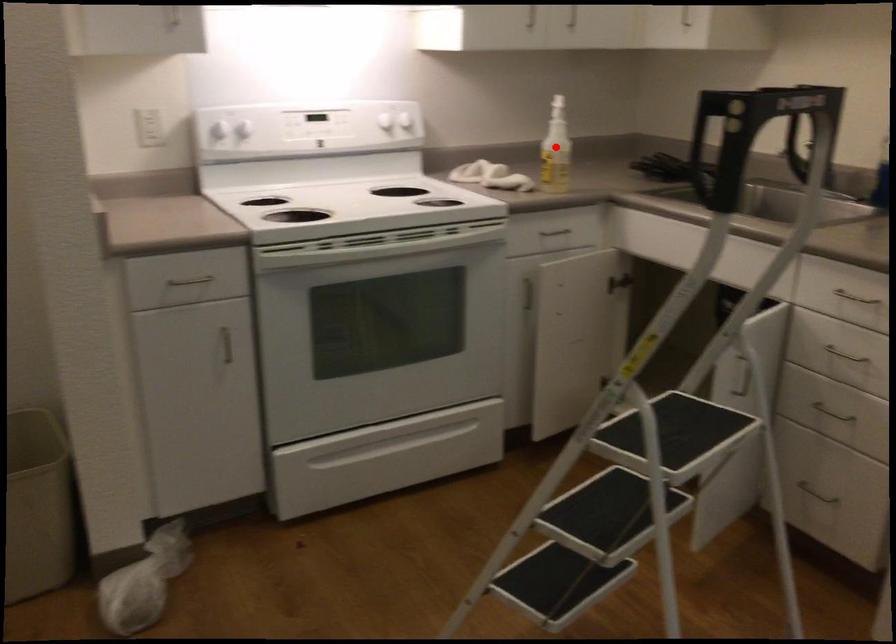
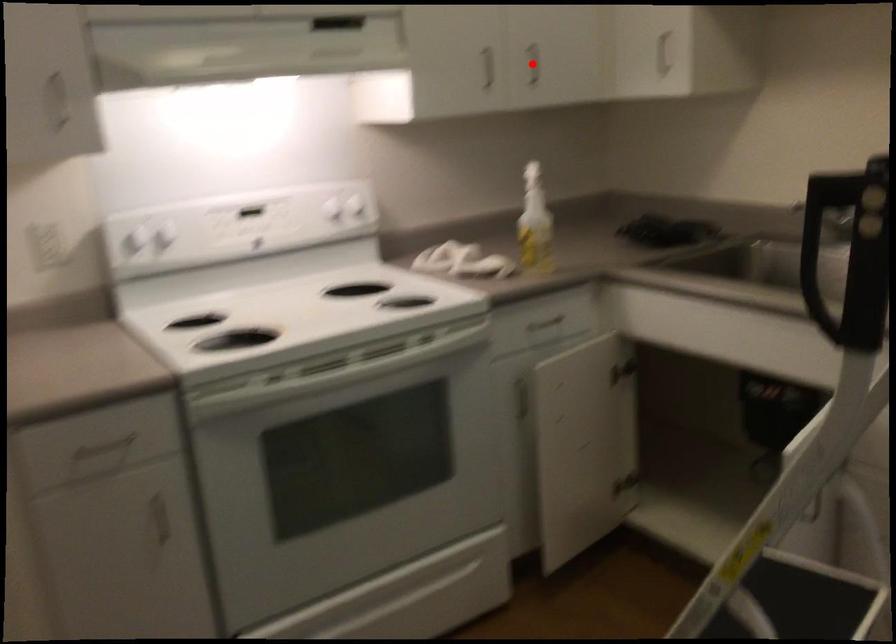
I am providing you with two images of the same scene from different viewpoints. A red point is marked on the first image and another point is marked on the second image. Is the red point in image1 aligned with the point shown in image2?

No